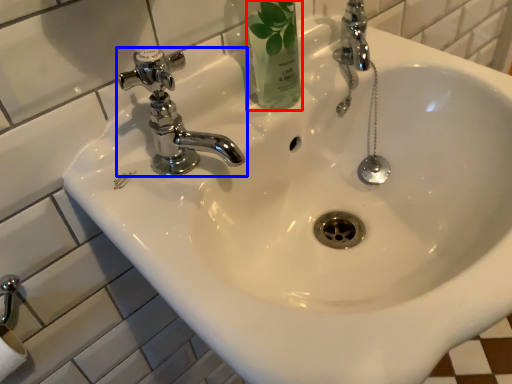
Question: Among these objects, which one is nearest to the camera, mouthwash (highlighted by a red box) or tap (highlighted by a blue box)?

Choices:
 (A) mouthwash
 (B) tap

Answer: (B)